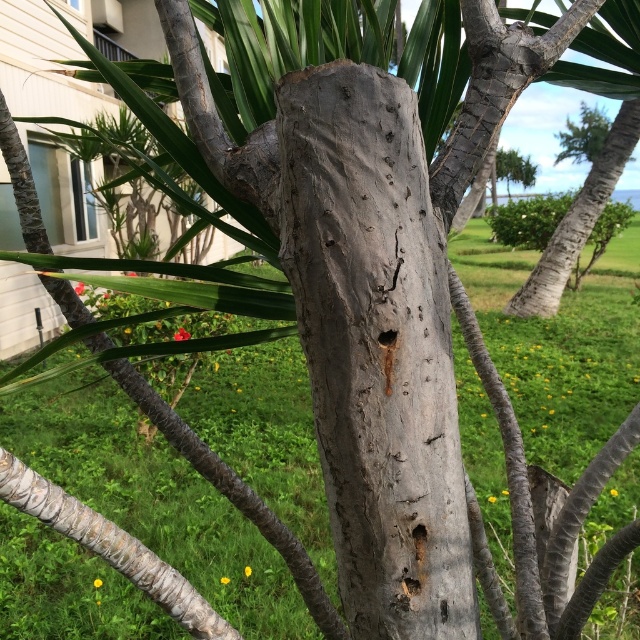
Based on the photo, you are a botanist examining the gray rough bark tree trunk at center and the gray textured trunk at center. Which one has a smaller width?

The gray rough bark tree trunk at center has a smaller width compared to the gray textured trunk at center.

You are standing 5 feet away from the gray rough bark tree trunk at center. If you take a step forward, will you be closer than 3.77 feet to the trunk?

The distance of gray rough bark tree trunk at center from camera is 3.77 feet. If you take a step forward from 5 feet away, you will be closer than 3.77 feet to the trunk.

You are a botanist examining two tree trunks in a tropical forest. You see the gray rough bark tree trunk at center and the gray textured trunk at center. Which one has a smaller diameter?

The gray rough bark tree trunk at center has a smaller diameter than the gray textured trunk at center.